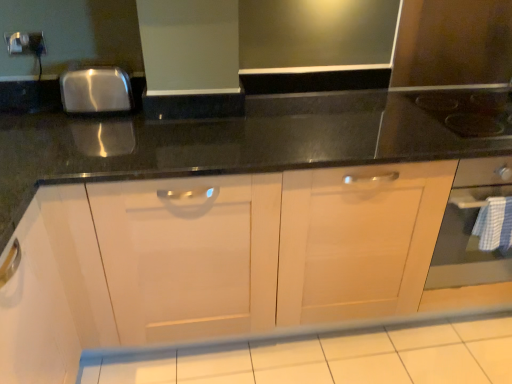
Question: From a real-world perspective, is white glossy tile at lower center located higher than black glass gas stove at upper right?

Choices:
 (A) yes
 (B) no

Answer: (B)

Question: Does white glossy tile at lower center come in front of black glass gas stove at upper right?

Choices:
 (A) yes
 (B) no

Answer: (A)

Question: Considering the relative sizes of white glossy tile at lower center and black glass gas stove at upper right in the image provided, is white glossy tile at lower center shorter than black glass gas stove at upper right?

Choices:
 (A) no
 (B) yes

Answer: (B)

Question: From the image's perspective, is white glossy tile at lower center beneath black glass gas stove at upper right?

Choices:
 (A) no
 (B) yes

Answer: (B)

Question: From a real-world perspective, is white glossy tile at lower center physically below black glass gas stove at upper right?

Choices:
 (A) no
 (B) yes

Answer: (B)

Question: In the image, is black glass gas stove at upper right positioned in front of or behind metallic silver electric outlet at upper left?

Choices:
 (A) behind
 (B) front

Answer: (B)

Question: From a real-world perspective, relative to metallic silver electric outlet at upper left, is black glass gas stove at upper right vertically above or below?

Choices:
 (A) below
 (B) above

Answer: (A)

Question: Considering the positions of black glass gas stove at upper right and metallic silver electric outlet at upper left in the image, is black glass gas stove at upper right taller or shorter than metallic silver electric outlet at upper left?

Choices:
 (A) short
 (B) tall

Answer: (A)

Question: Does point (473, 122) appear closer or farther from the camera than point (10, 46)?

Choices:
 (A) farther
 (B) closer

Answer: (B)

Question: Is white glossy tile at lower center inside or outside of black glass gas stove at upper right?

Choices:
 (A) outside
 (B) inside

Answer: (A)

Question: From their relative heights in the image, would you say white glossy tile at lower center is taller or shorter than black glass gas stove at upper right?

Choices:
 (A) short
 (B) tall

Answer: (A)

Question: From a real-world perspective, relative to black glass gas stove at upper right, is white glossy tile at lower center vertically above or below?

Choices:
 (A) below
 (B) above

Answer: (A)

Question: Considering their positions, is white glossy tile at lower center located in front of or behind black glass gas stove at upper right?

Choices:
 (A) behind
 (B) front

Answer: (B)

Question: From their relative heights in the image, would you say black glass gas stove at upper right is taller or shorter than white glossy tile at lower center?

Choices:
 (A) short
 (B) tall

Answer: (B)

Question: Is black glass gas stove at upper right in front of or behind white glossy tile at lower center in the image?

Choices:
 (A) front
 (B) behind

Answer: (B)